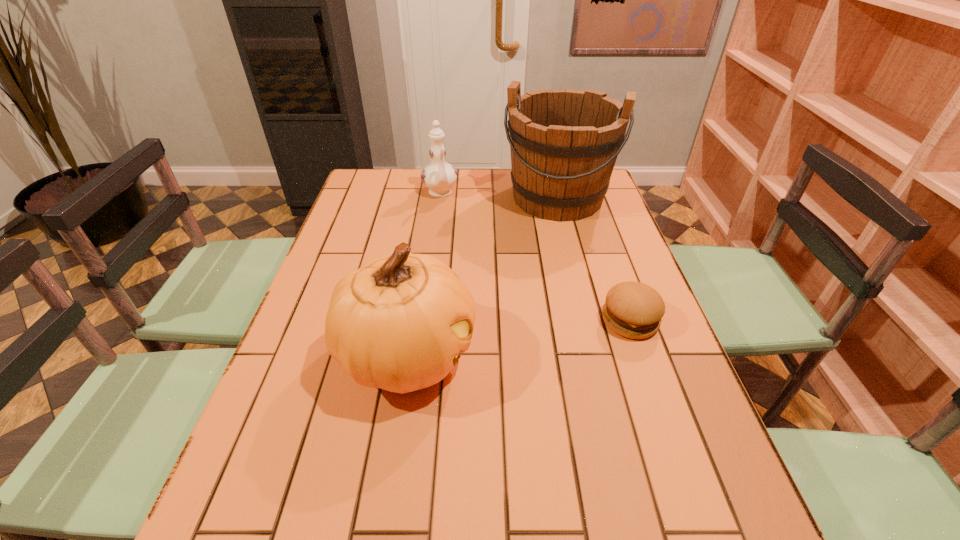
At what (x,y) coordinates should I click in order to perform the action: click on vacant area that lies between the hamburger and the wine bucket. Please return your answer as a coordinate pair (x, y). Looking at the image, I should click on point(593,259).

Locate an element on the screen. The image size is (960, 540). vacant area between the shortest object and the tallest object is located at coordinates (593, 259).

Where is `vacant area that lies between the shortest object and the wine bucket`? The height and width of the screenshot is (540, 960). vacant area that lies between the shortest object and the wine bucket is located at coordinates (593, 259).

Identify the location of object identified as the second closest to the tallest object. The width and height of the screenshot is (960, 540). (632, 309).

Identify which object is located as the second nearest to the pumpkin. Please provide its 2D coordinates. Your answer should be formatted as a tuple, i.e. [(x, y)], where the tuple contains the x and y coordinates of a point satisfying the conditions above.

[(564, 143)]

This screenshot has width=960, height=540. In order to click on vacant space that satisfies the following two spatial constraints: 1. on the front side of the shortest object; 2. on the right side of the chinaware in this screenshot , I will do `click(423, 320)`.